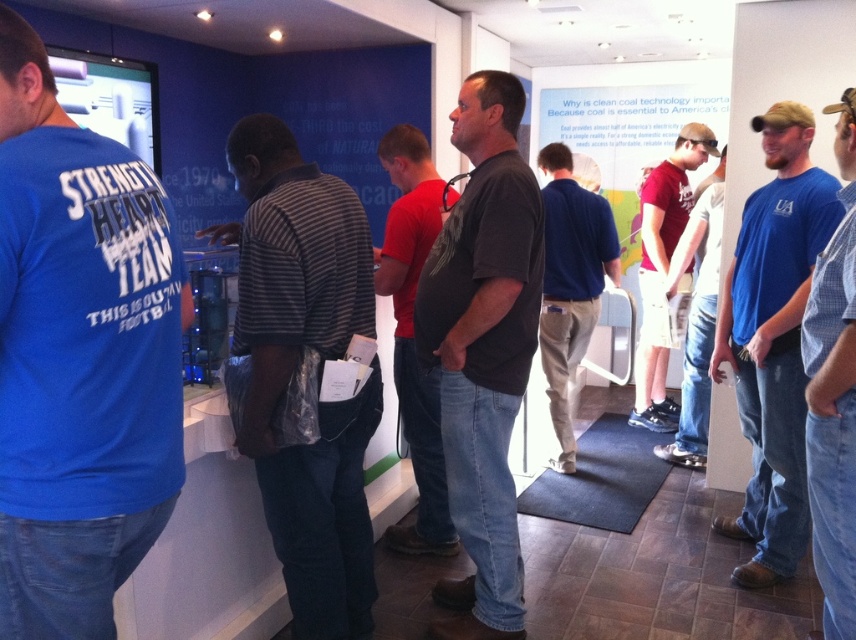
Who is lower down, dark gray striped shirt at center or matte red shirt at center?

Positioned lower is dark gray striped shirt at center.

Between dark gray striped shirt at center and matte red shirt at center, which one has less height?

dark gray striped shirt at center is shorter.

Is point (399, 160) more distant than point (687, 157)?

No.

Locate an element on the screen. dark gray striped shirt at center is located at coordinates (412, 333).

Is striped cotton shirt at center to the left of dark gray striped shirt at center from the viewer's perspective?

Yes, striped cotton shirt at center is to the left of dark gray striped shirt at center.

Does striped cotton shirt at center appear over dark gray striped shirt at center?

Actually, striped cotton shirt at center is below dark gray striped shirt at center.

Locate an element on the screen. striped cotton shirt at center is located at coordinates (294, 368).

Where is `striped cotton shirt at center`? Image resolution: width=856 pixels, height=640 pixels. striped cotton shirt at center is located at coordinates (294, 368).

In the scene shown: Is blue cotton t-shirt at right shorter than matte red shirt at center?

Yes.

Which is behind, point (837, 202) or point (651, 362)?

Point (651, 362)

Locate an element on the screen. This screenshot has width=856, height=640. blue cotton t-shirt at right is located at coordinates (773, 339).